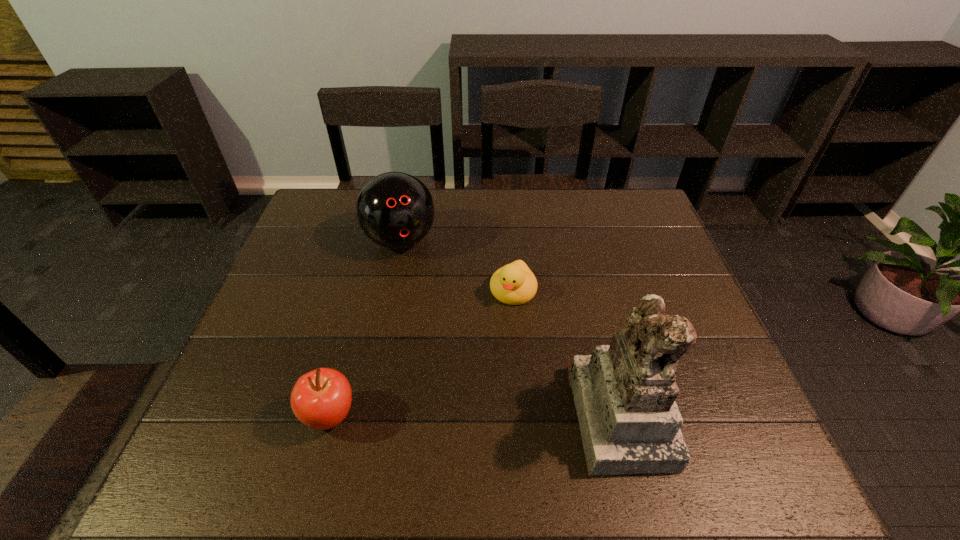
In order to click on vacant point that satisfies the following two spatial constraints: 1. on the back side of the tallest object; 2. on the front-facing side of the apple in this screenshot , I will do `click(331, 414)`.

I want to click on vacant region that satisfies the following two spatial constraints: 1. on the front side of the third nearest object; 2. on the right side of the bowling ball, so click(391, 291).